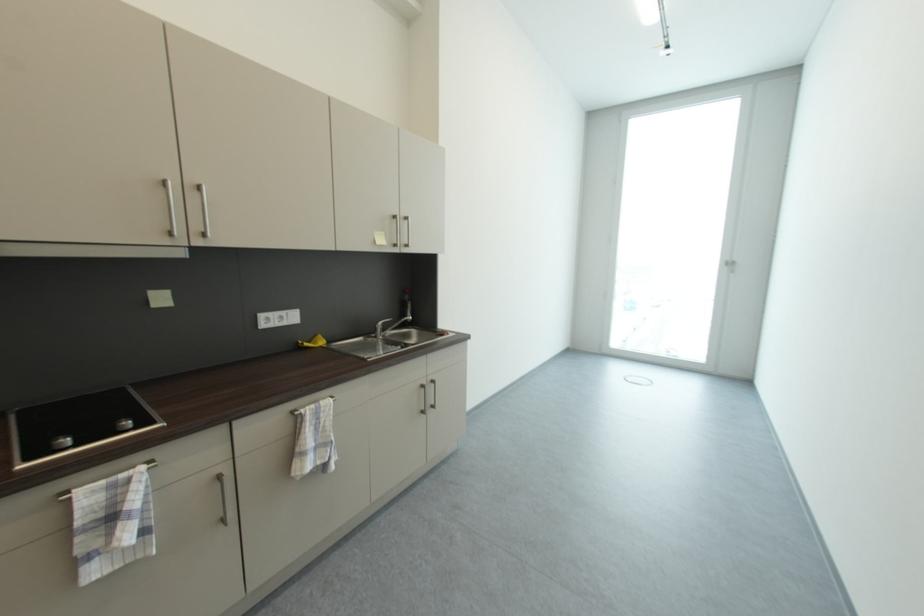
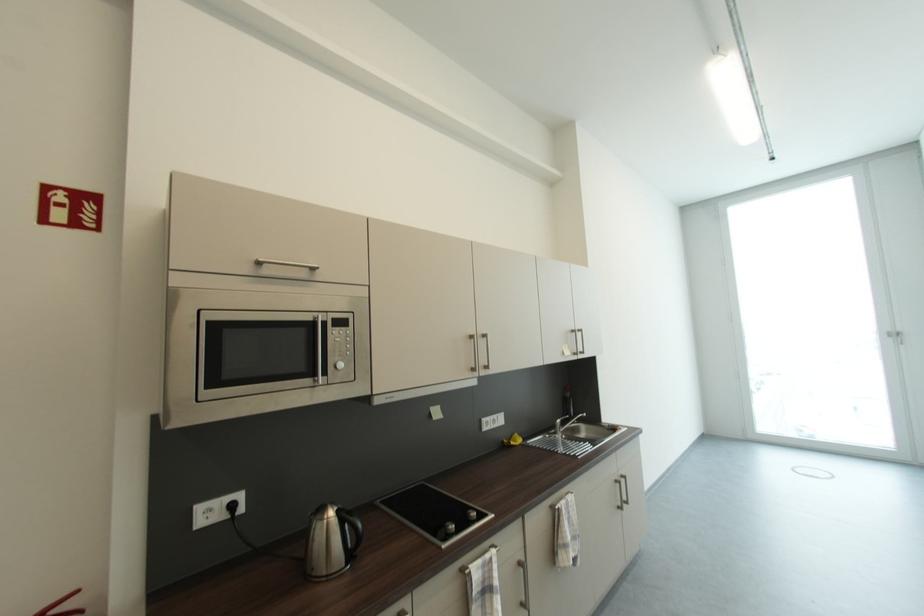
Question: Based on the continuous images, in which direction is the camera rotating? Reply with the corresponding letter.

Choices:
 (A) Left
 (B) Right
 (C) Up
 (D) Down

Answer: (C)